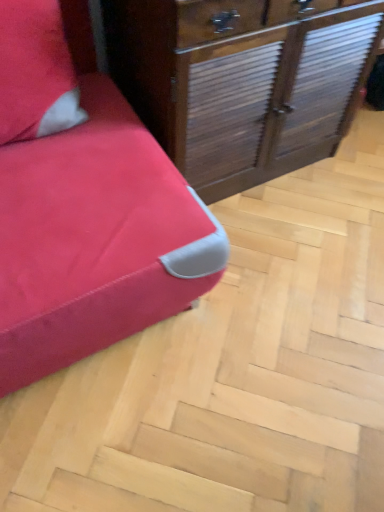
Question: Would you say wooden with slats chest of drawers at center is inside or outside matte red sofa at left?

Choices:
 (A) outside
 (B) inside

Answer: (A)

Question: Considering the positions of point (332, 115) and point (61, 170), is point (332, 115) closer or farther from the camera than point (61, 170)?

Choices:
 (A) closer
 (B) farther

Answer: (B)

Question: Relative to matte red sofa at left, is wooden with slats chest of drawers at center in front or behind?

Choices:
 (A) front
 (B) behind

Answer: (B)

Question: Looking at the image, does matte red sofa at left seem bigger or smaller compared to wooden with slats chest of drawers at center?

Choices:
 (A) small
 (B) big

Answer: (B)

Question: From the image's perspective, is matte red sofa at left positioned above or below wooden with slats chest of drawers at center?

Choices:
 (A) above
 (B) below

Answer: (B)

Question: Considering the relative positions of matte red sofa at left and wooden with slats chest of drawers at center in the image provided, is matte red sofa at left to the left or to the right of wooden with slats chest of drawers at center?

Choices:
 (A) left
 (B) right

Answer: (A)

Question: Looking at their shapes, would you say matte red sofa at left is wider or thinner than wooden with slats chest of drawers at center?

Choices:
 (A) thin
 (B) wide

Answer: (B)